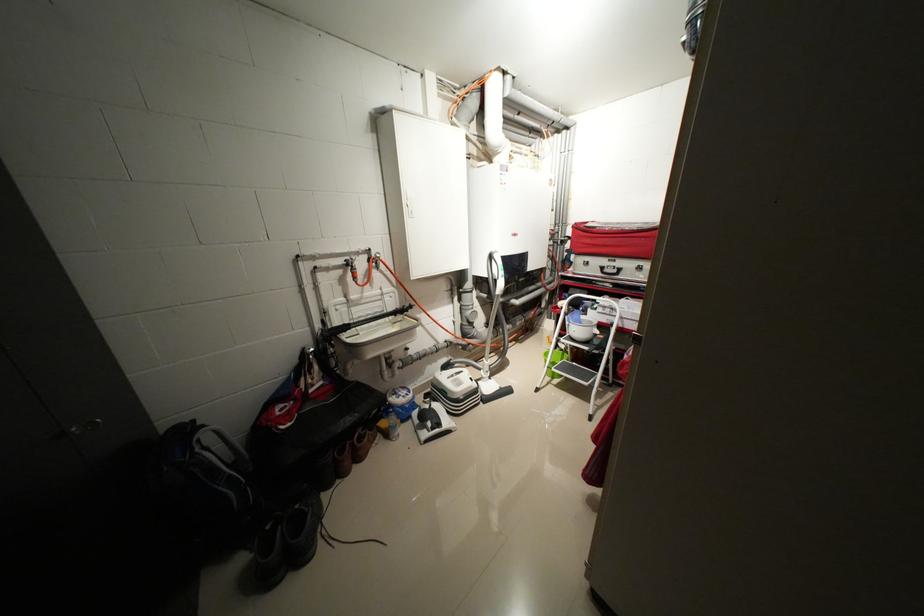
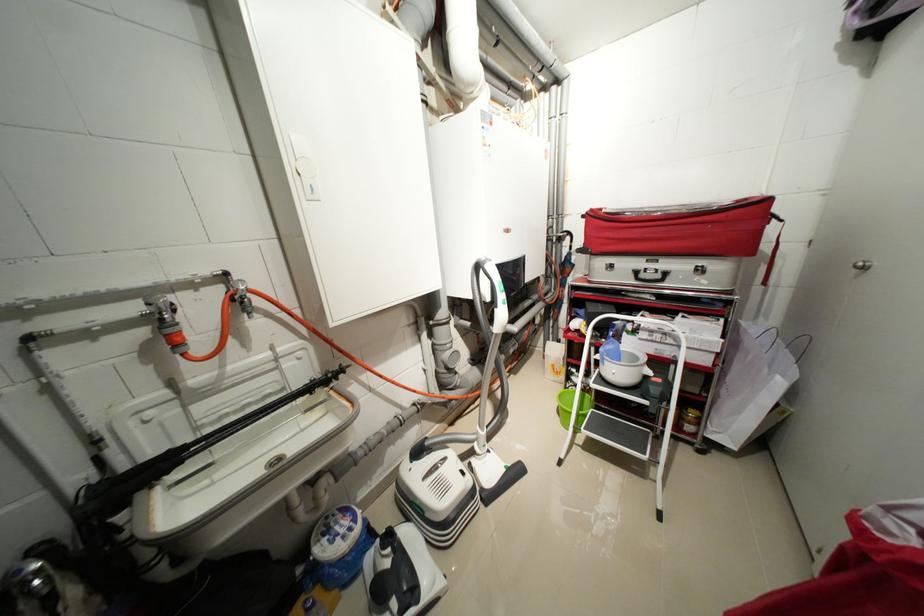
Question: How did the camera likely rotate?

Choices:
 (A) Left
 (B) Right
 (C) Up
 (D) Down

Answer: (B)